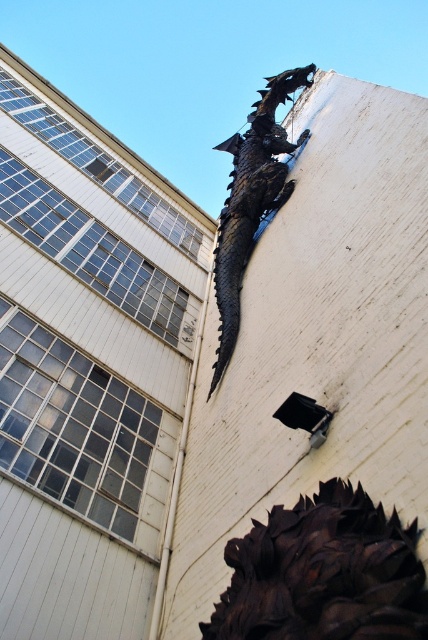
You are an architect analyzing the placement of two dragon sculptures on a building facade. The rusty metal dragon at upper right and the dark matte metal dragon at upper center are both mounted on the wall. Based on their positions, which dragon is closer to the left side of the building?

The rusty metal dragon at upper right is to the left of the dark matte metal dragon at upper center, so it is closer to the left side of the building.

Based on the photo, you are an architect examining the dragon sculptures on the building. Which dragon, the rusty metal dragon at upper right or the dark matte metal dragon at upper center, is positioned closer to the building wall?

The rusty metal dragon at upper right is closer to the viewer than the dark matte metal dragon at upper center, so the dark matte metal dragon at upper center is positioned closer to the building wall.

Looking at this image, you are an architect evaluating the dragon sculptures on the building. Which dragon sculpture, the rusty metal dragon at upper right or the dark matte metal dragon at upper center, has a greater width?

The dark matte metal dragon at upper center is wider than the rusty metal dragon at upper right.